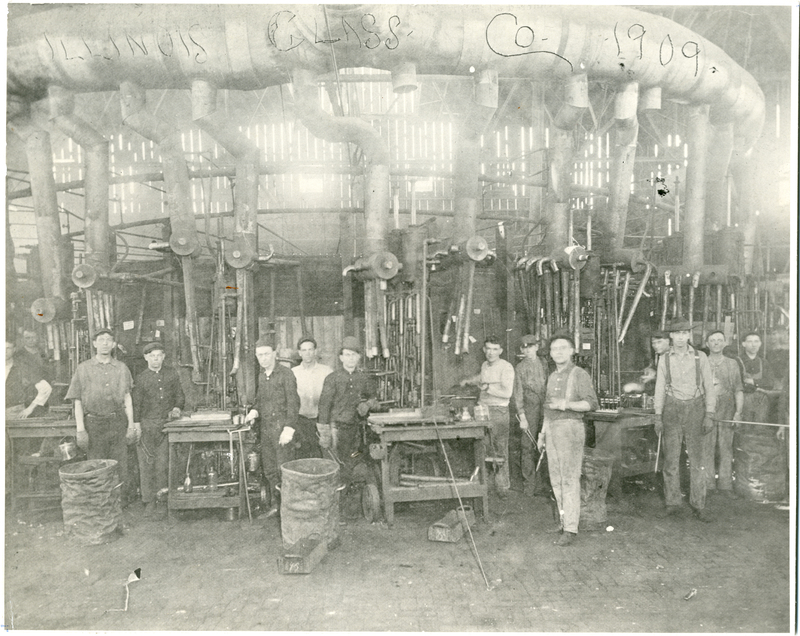
This screenshot has height=636, width=800. Identify the location of floor. (580, 572), (220, 572).